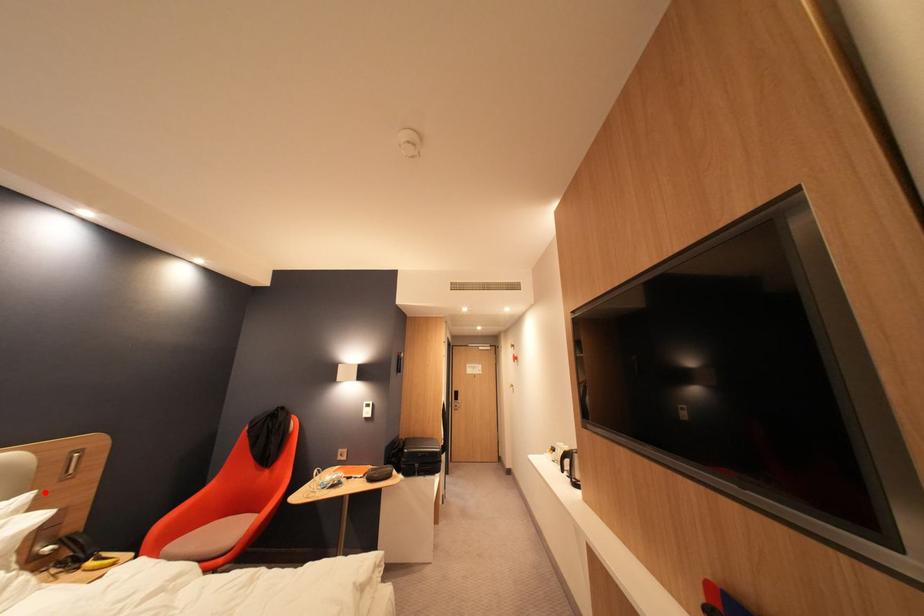
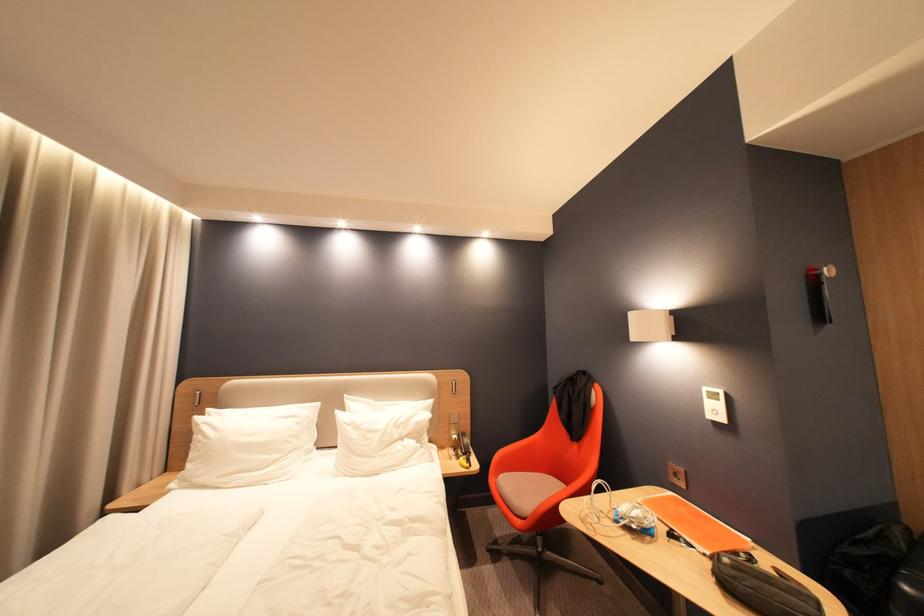
Question: A red point is marked in image1. In image2, is the corresponding 3D point closer to the camera or farther? Reply with the corresponding letter.

Choices:
 (A) The corresponding 3D point is closer.
 (B) The corresponding 3D point is farther.

Answer: (B)